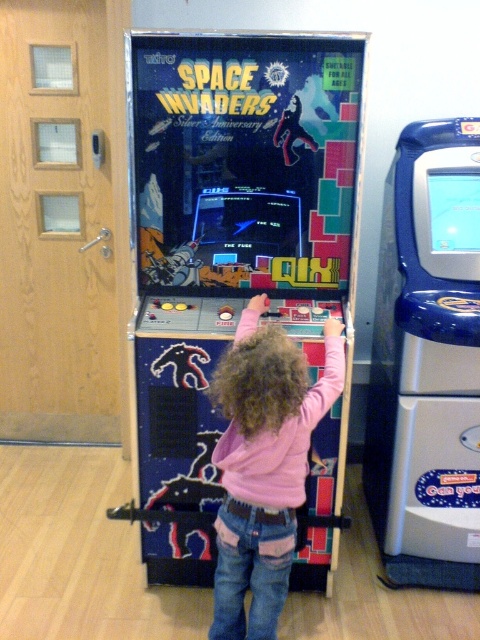
Question: Which point is farther to the camera?

Choices:
 (A) (274, 387)
 (B) (435, 460)

Answer: (B)

Question: Is the position of blue plastic vending machine at right more distant than that of pink fleece at center?

Choices:
 (A) yes
 (B) no

Answer: (A)

Question: Is blue plastic vending machine at right wider than pink fleece at center?

Choices:
 (A) no
 (B) yes

Answer: (A)

Question: Does blue plastic vending machine at right have a larger size compared to pink fleece at center?

Choices:
 (A) no
 (B) yes

Answer: (B)

Question: Which object is closer to the camera taking this photo?

Choices:
 (A) blue plastic vending machine at right
 (B) pink fleece at center

Answer: (B)